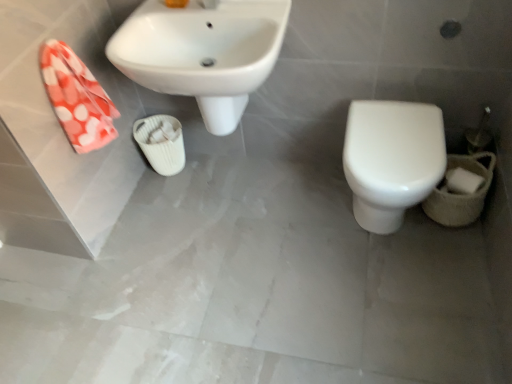
Question: Is orange polka dot fabric at left taller than white ribbed cup at center?

Choices:
 (A) yes
 (B) no

Answer: (A)

Question: Considering the relative positions of orange polka dot fabric at left and white ribbed cup at center in the image provided, is orange polka dot fabric at left in front of white ribbed cup at center?

Choices:
 (A) no
 (B) yes

Answer: (B)

Question: Is white ribbed cup at center located within orange polka dot fabric at left?

Choices:
 (A) yes
 (B) no

Answer: (B)

Question: Is orange polka dot fabric at left facing towards white ribbed cup at center?

Choices:
 (A) yes
 (B) no

Answer: (B)

Question: Considering the relative sizes of orange polka dot fabric at left and white ribbed cup at center in the image provided, is orange polka dot fabric at left smaller than white ribbed cup at center?

Choices:
 (A) no
 (B) yes

Answer: (B)

Question: From the image's perspective, would you say orange polka dot fabric at left is shown under white ribbed cup at center?

Choices:
 (A) yes
 (B) no

Answer: (B)

Question: Is white matte toilet paper at lower right far from white ribbed cup at center?

Choices:
 (A) yes
 (B) no

Answer: (A)

Question: Is white matte toilet paper at lower right shorter than white ribbed cup at center?

Choices:
 (A) no
 (B) yes

Answer: (B)

Question: Does white matte toilet paper at lower right appear on the right side of white ribbed cup at center?

Choices:
 (A) no
 (B) yes

Answer: (B)

Question: Is white matte toilet paper at lower right positioned with its back to white ribbed cup at center?

Choices:
 (A) yes
 (B) no

Answer: (B)

Question: From a real-world perspective, is white matte toilet paper at lower right under white ribbed cup at center?

Choices:
 (A) yes
 (B) no

Answer: (B)

Question: Is white matte toilet paper at lower right positioned before white ribbed cup at center?

Choices:
 (A) no
 (B) yes

Answer: (B)

Question: Is white matte toilet paper at lower right taller than white glossy toilet at lower right?

Choices:
 (A) yes
 (B) no

Answer: (B)